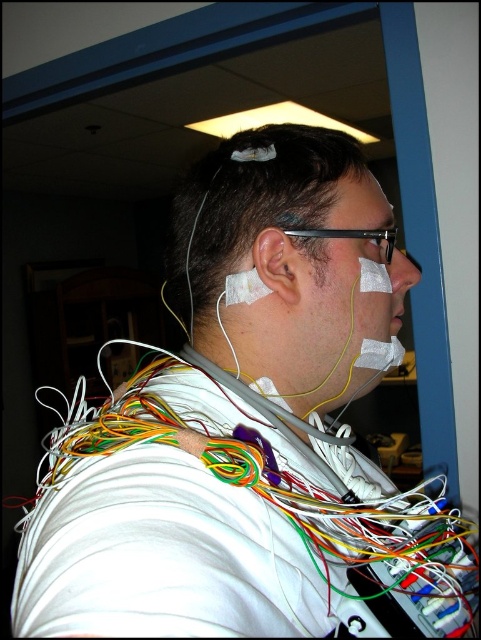
Question: Which object is the closest to the matte skin ear at center?

Choices:
 (A) matte skin at upper center
 (B) matte skin nose at center
 (C) white adhesive tape at center
 (D) white adhesive tape at right

Answer: (C)

Question: Which of the following is the closest to the observer?

Choices:
 (A) matte skin nose at center
 (B) matte skin ear at center
 (C) white adhesive tape at center
 (D) white adhesive tape at right

Answer: (C)

Question: Does matte skin nose at center have a smaller size compared to matte skin at upper center?

Choices:
 (A) no
 (B) yes

Answer: (B)

Question: Which point is closer to the camera taking this photo?

Choices:
 (A) (287, 300)
 (B) (415, 264)
 (C) (406, 339)

Answer: (A)

Question: From the image, what is the correct spatial relationship of matte skin nose at center in relation to matte skin at upper center?

Choices:
 (A) left
 (B) right

Answer: (A)

Question: Can you confirm if white adhesive tape at center is positioned above matte skin ear at center?

Choices:
 (A) yes
 (B) no

Answer: (A)